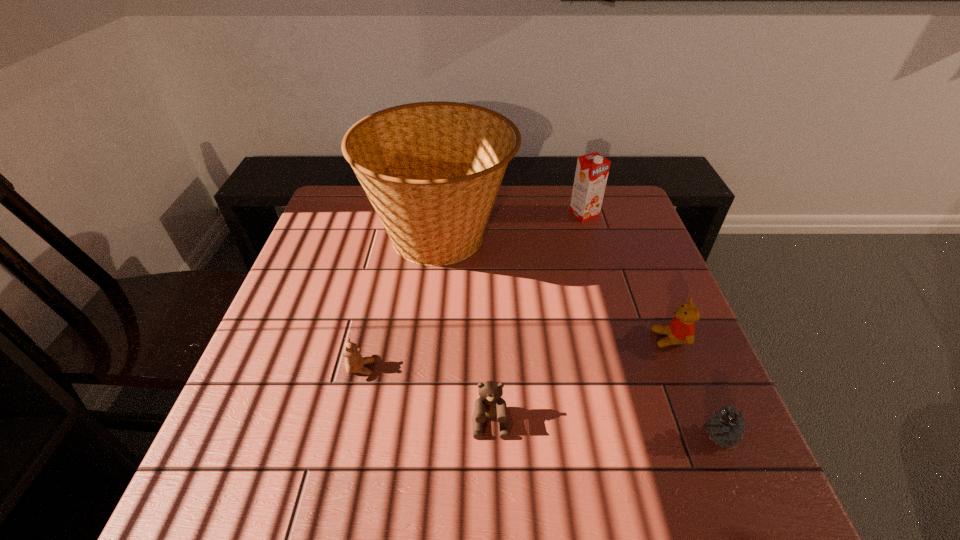
The height and width of the screenshot is (540, 960). I want to click on pinecone that is at the right edge, so click(726, 428).

At what (x,y) coordinates should I click in order to perform the action: click on object at the far left corner. Please return your answer as a coordinate pair (x, y). Image resolution: width=960 pixels, height=540 pixels. Looking at the image, I should click on (x=432, y=170).

This screenshot has width=960, height=540. I want to click on object that is at the far right corner, so click(x=592, y=169).

This screenshot has width=960, height=540. Identify the location of blank area at the far edge. (523, 221).

This screenshot has height=540, width=960. I want to click on free region at the near edge of the desktop, so click(x=667, y=489).

The image size is (960, 540). I want to click on blank space at the left edge of the desktop, so click(287, 288).

Image resolution: width=960 pixels, height=540 pixels. What are the coordinates of `free point at the right edge` in the screenshot? It's located at pos(621,271).

Identify the location of free space at the far left corner of the desktop. (358, 201).

Identify the location of vacant area at the near left corner of the desktop. (253, 478).

This screenshot has height=540, width=960. Identify the location of vacant space at the far right corner. (608, 216).